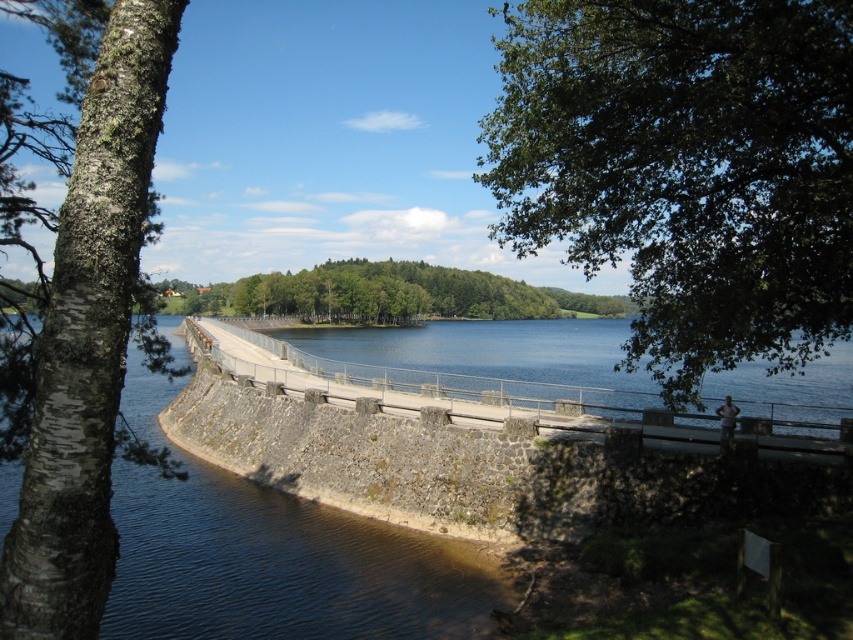
Question: Which of these objects is positioned farthest from the smooth concrete bridge at center?

Choices:
 (A) green leafy tree at upper right
 (B) barky white tree at left

Answer: (B)

Question: Which point is closer to the camera?

Choices:
 (A) (619, 12)
 (B) (415, 266)

Answer: (A)

Question: Can you confirm if smooth concrete bridge at center is positioned below green leafy tree at center?

Choices:
 (A) no
 (B) yes

Answer: (B)

Question: Does smooth concrete bridge at center have a lesser width compared to green leafy tree at center?

Choices:
 (A) no
 (B) yes

Answer: (B)

Question: Does barky white tree at left have a larger size compared to green leafy tree at center?

Choices:
 (A) no
 (B) yes

Answer: (A)

Question: Which point is closer to the camera?

Choices:
 (A) green leafy tree at center
 (B) smooth concrete bridge at center

Answer: (B)